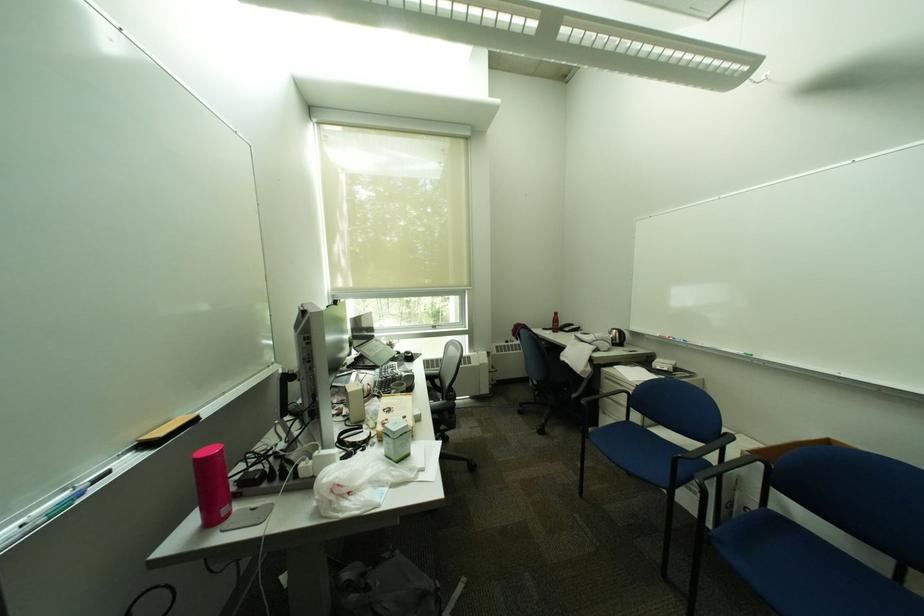
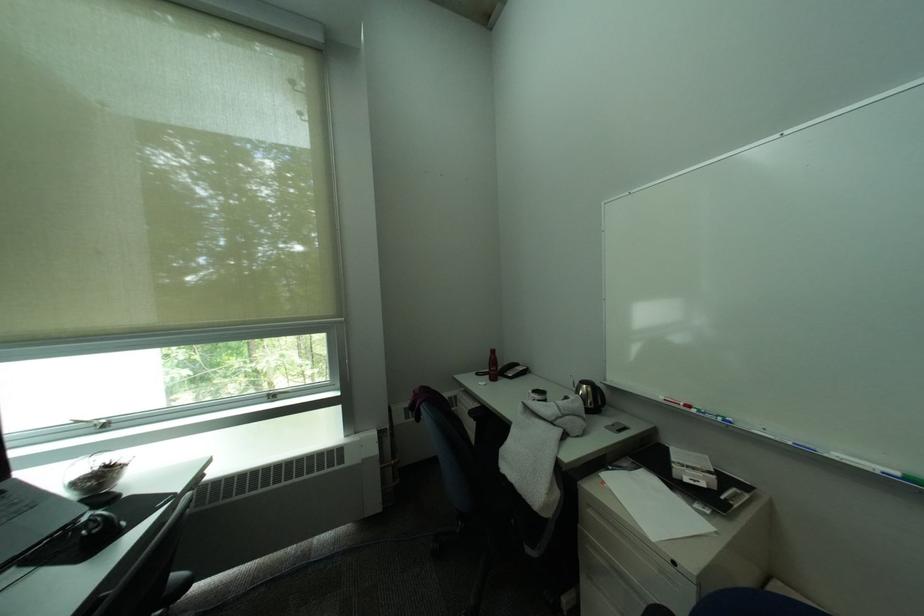
Which direction would the cameraman need to move to produce the second image?

The cameraman walked toward right, forward.